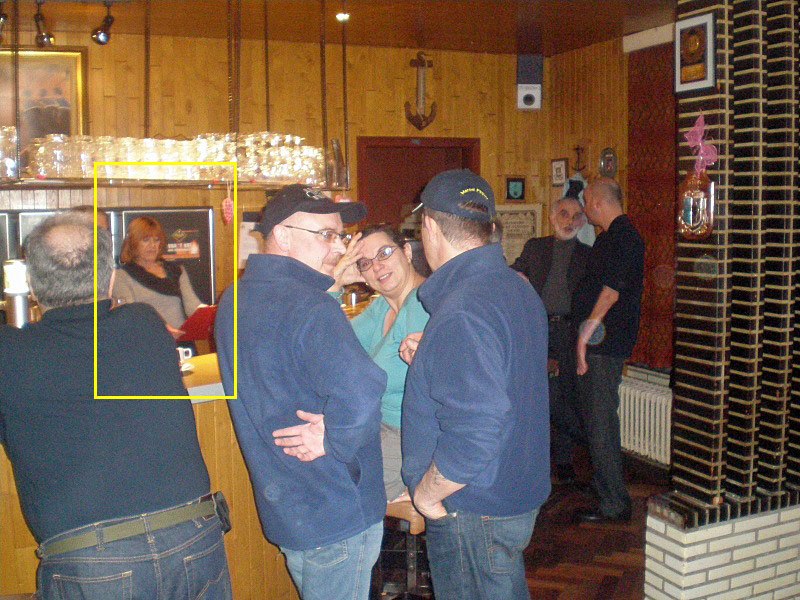
Locate an element on the screen. The image size is (800, 600). radiator is located at coordinates (638, 419).